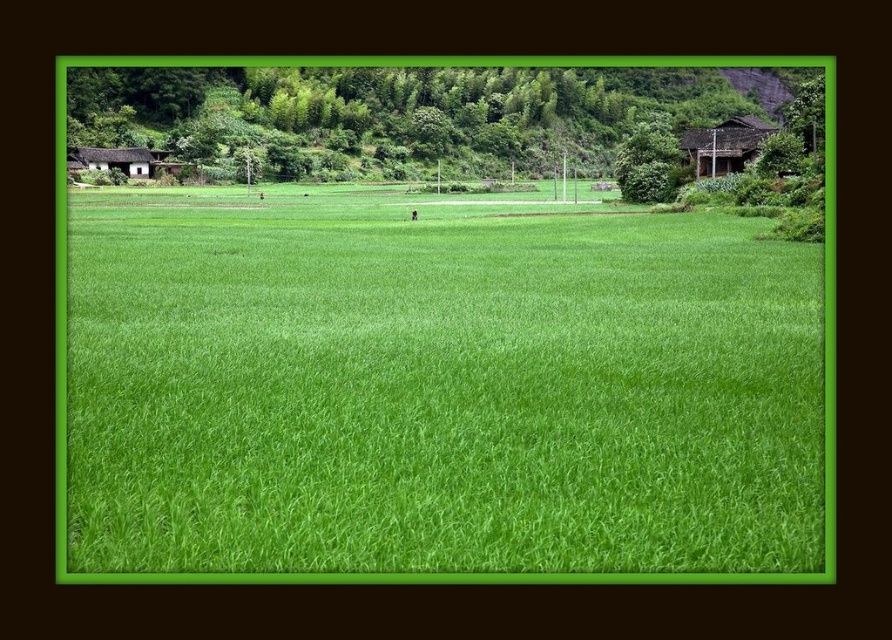
Question: Can you confirm if green grass at center is positioned to the right of brown wooden hut at upper right?

Choices:
 (A) no
 (B) yes

Answer: (A)

Question: Can you confirm if brown wooden hut at upper right is smaller than brown wooden hut at left?

Choices:
 (A) yes
 (B) no

Answer: (B)

Question: Which of these objects is positioned closest to the brown wooden hut at upper right?

Choices:
 (A) brown wooden hut at left
 (B) green grass at center

Answer: (B)

Question: Which point is farther to the camera?

Choices:
 (A) (142, 170)
 (B) (712, 147)
 (C) (626, 378)

Answer: (A)

Question: Does green grass at center come behind brown wooden hut at upper right?

Choices:
 (A) no
 (B) yes

Answer: (A)

Question: Estimate the real-world distances between objects in this image. Which object is farther from the brown wooden hut at left?

Choices:
 (A) green grass at center
 (B) brown wooden hut at upper right

Answer: (A)